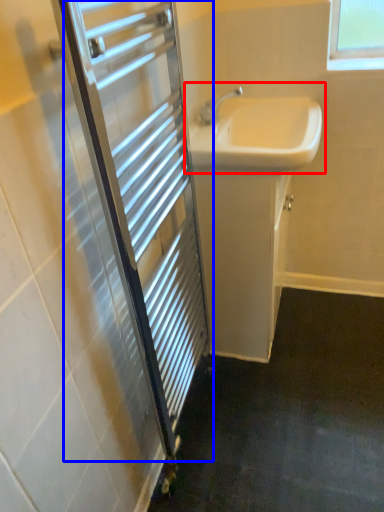
Question: Which point is closer to the camera, sink (highlighted by a red box) or screen door (highlighted by a blue box)?

Choices:
 (A) sink
 (B) screen door

Answer: (B)